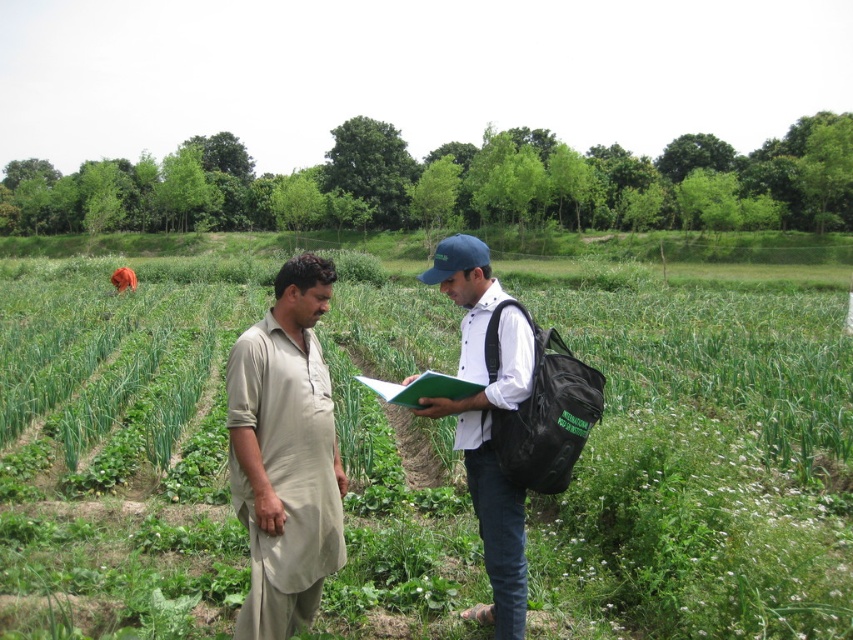
Is green grass at center wider than beige cotton kurta at center?

Correct, the width of green grass at center exceeds that of beige cotton kurta at center.

Based on the photo, measure the distance between green grass at center and camera.

green grass at center is 3.06 meters away from camera.

Identify the location of green grass at center. The image size is (853, 640). coord(701,468).

Consider the image. Can you confirm if green grass at center is wider than white matte shirt at center?

Yes, green grass at center is wider than white matte shirt at center.

Does green grass at center have a lesser height compared to white matte shirt at center?

No.

Is point (695, 436) in front of point (488, 294)?

No, it is behind (488, 294).

Identify the location of green grass at center. (701, 468).

Which is behind, point (328, 292) or point (492, 458)?

Positioned behind is point (328, 292).

Between point (300, 324) and point (474, 285), which one is positioned in front?

Point (300, 324) is in front.

Where is `beige cotton kurta at center`? beige cotton kurta at center is located at coordinates (285, 454).